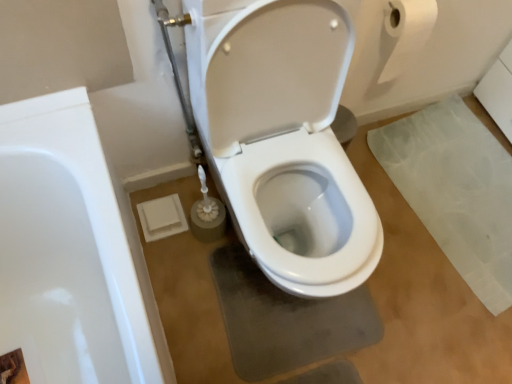
Find the location of a particular element. white glossy toilet at center is located at coordinates point(283,136).

Describe the element at coordinates (283, 136) in the screenshot. Image resolution: width=512 pixels, height=384 pixels. I see `white glossy toilet at center` at that location.

Find the location of a particular element. The width and height of the screenshot is (512, 384). white glossy toilet at center is located at coordinates (283, 136).